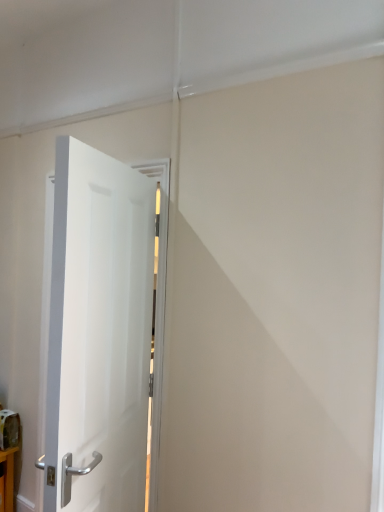
This screenshot has width=384, height=512. What do you see at coordinates (98, 333) in the screenshot? I see `white glossy door at left` at bounding box center [98, 333].

Locate an element on the screen. white glossy door at left is located at coordinates (98, 333).

Identify the location of white glossy door at left. This screenshot has height=512, width=384. (98, 333).